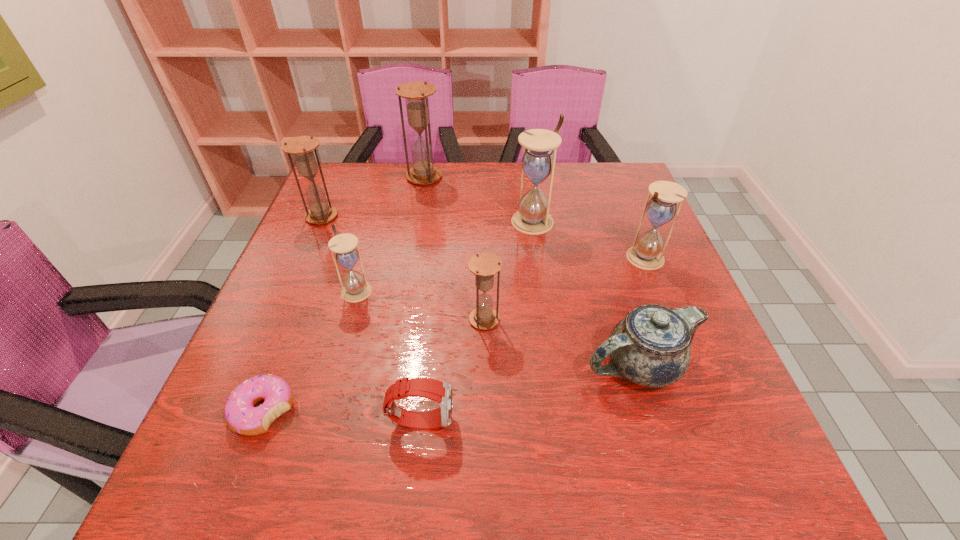
Find the location of a particular element. the fifth farthest object is located at coordinates (356, 288).

The image size is (960, 540). Identify the location of the leftmost white hourglass. pos(356,288).

In order to click on chinaware in this screenshot , I will do `click(651, 346)`.

You are a GUI agent. You are given a task and a screenshot of the screen. Output one action in this format:
    pyautogui.click(x=<x>, y=<y>)
    Task: Click on the watch
    The height and width of the screenshot is (540, 960).
    Given the screenshot: What is the action you would take?
    pyautogui.click(x=440, y=391)

Locate an element on the screen. The height and width of the screenshot is (540, 960). red watch is located at coordinates (440, 391).

At what (x,y) coordinates should I click in order to perform the action: click on pink doughnut. Please return your answer as a coordinate pair (x, y). Looking at the image, I should click on (241, 415).

Image resolution: width=960 pixels, height=540 pixels. I want to click on doughnut, so click(x=241, y=415).

The height and width of the screenshot is (540, 960). What are the coordinates of `vacant space located 0.070m on the front of the fourth hourglass from right to left` in the screenshot? It's located at (420, 200).

Find the location of `vacant space located on the front of the biggest white hourglass`. vacant space located on the front of the biggest white hourglass is located at coordinates (550, 340).

This screenshot has width=960, height=540. Identify the location of vacant region located on the front of the leftmost brown hourglass. (300, 267).